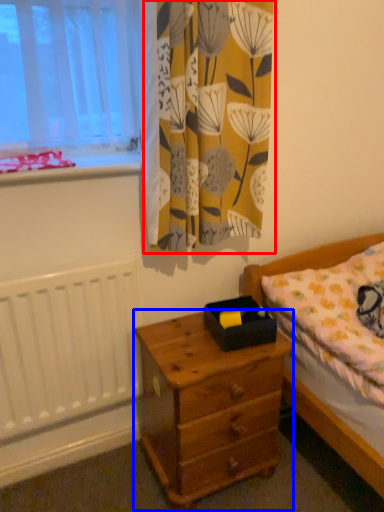
Question: Which point is closer to the camera, curtain (highlighted by a red box) or nightstand (highlighted by a blue box)?

Choices:
 (A) curtain
 (B) nightstand

Answer: (A)